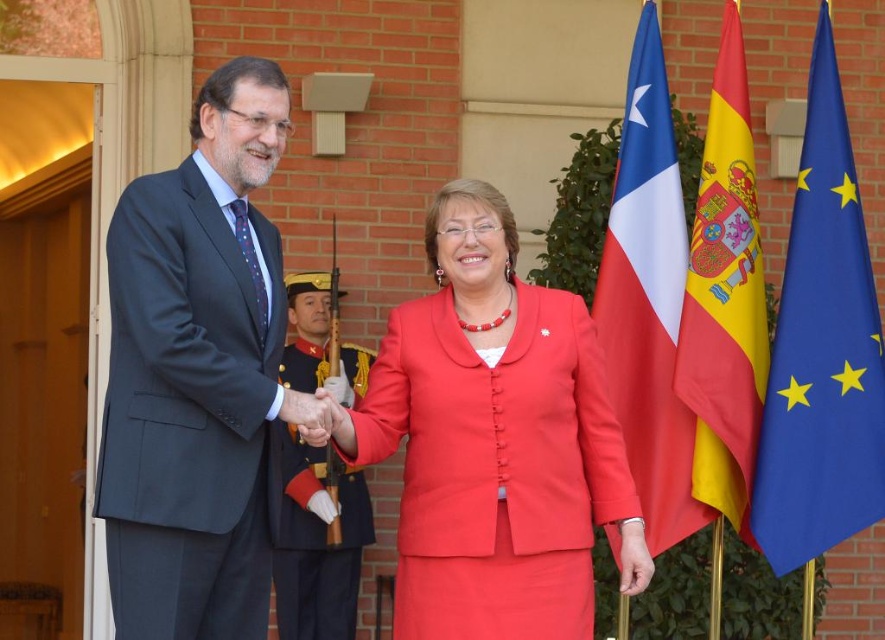
Can you confirm if dark blue suit at left is smaller than matte black suit at left?

No.

Does dark blue suit at left lie in front of matte black suit at left?

No.

At what (x,y) coordinates should I click in order to perform the action: click on dark blue suit at left. Please return your answer as a coordinate pair (x, y). The width and height of the screenshot is (885, 640). Looking at the image, I should click on (197, 374).

You are a GUI agent. You are given a task and a screenshot of the screen. Output one action in this format:
    pyautogui.click(x=<x>, y=<y>)
    Task: Click on the dark blue suit at left
    Image resolution: width=885 pixels, height=640 pixels.
    Given the screenshot: What is the action you would take?
    pyautogui.click(x=197, y=374)

Measure the distance from matte red suit at center to dark blue woolen suit at center.

The distance of matte red suit at center from dark blue woolen suit at center is 6.93 feet.

Who is taller, matte red suit at center or dark blue woolen suit at center?

matte red suit at center is taller.

The width and height of the screenshot is (885, 640). I want to click on matte red suit at center, so click(495, 442).

Is matte red suit at center further to camera compared to yellow fabric flag at right?

No, matte red suit at center is closer to the viewer.

Between point (558, 513) and point (691, 330), which one is positioned in front?

Point (558, 513) is in front.

Where is `matte red suit at center`? This screenshot has width=885, height=640. matte red suit at center is located at coordinates (495, 442).